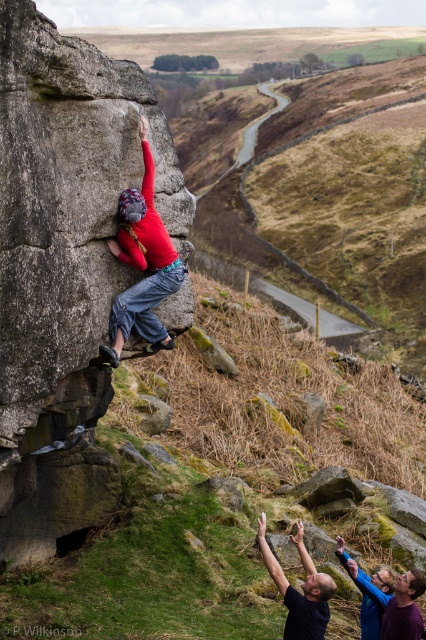
Is smooth gray rock at left shorter than blue denim shirt at lower right?

No.

Which is more to the left, smooth gray rock at left or blue denim shirt at lower right?

Positioned to the left is smooth gray rock at left.

Measure the distance between point (63, 534) and camera.

The distance of point (63, 534) from camera is 18.00 meters.

In order to click on smooth gray rock at left in this screenshot , I will do `click(65, 266)`.

Is matte red shirt at center to the right of blue denim shirt at lower right from the viewer's perspective?

In fact, matte red shirt at center is to the left of blue denim shirt at lower right.

Is matte red shirt at center positioned at the back of blue denim shirt at lower right?

Yes, it is.

The width and height of the screenshot is (426, 640). I want to click on matte red shirt at center, so [143, 264].

Does smooth gray rock at left have a lesser height compared to smooth skin man at center?

No, smooth gray rock at left is not shorter than smooth skin man at center.

Which is behind, point (54, 369) or point (316, 616)?

The point (54, 369) is more distant.

What are the coordinates of `smooth gray rock at left` in the screenshot? It's located at (65, 266).